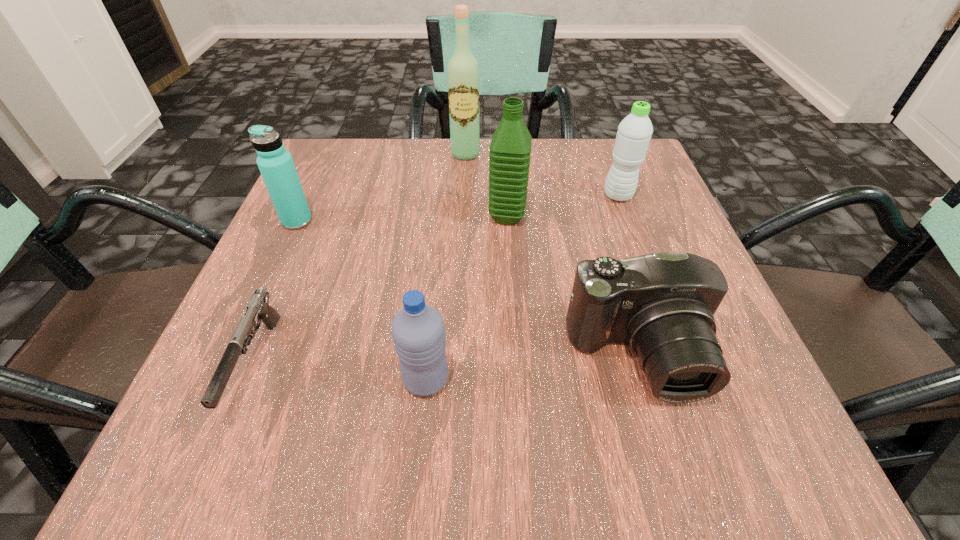
You are a GUI agent. You are given a task and a screenshot of the screen. Output one action in this format:
    pyautogui.click(x=<x>, y=<y>)
    Task: Click on the gun situated at the left edge
    This screenshot has width=960, height=540.
    Given the screenshot: What is the action you would take?
    pyautogui.click(x=258, y=308)

This screenshot has height=540, width=960. Find the location of `water bottle that is at the right edge`. water bottle that is at the right edge is located at coordinates (634, 132).

Find the location of a particular element. The height and width of the screenshot is (540, 960). camera that is at the right edge is located at coordinates (663, 304).

The height and width of the screenshot is (540, 960). Find the location of `object situated at the near left corner`. object situated at the near left corner is located at coordinates (258, 308).

The image size is (960, 540). I want to click on object that is at the far right corner, so click(x=634, y=132).

This screenshot has height=540, width=960. In the image, there is a desktop. Find the location of `blank space at the far edge`. blank space at the far edge is located at coordinates (442, 164).

In the image, there is a desktop. In order to click on vacant space at the near edge in this screenshot , I will do `click(302, 446)`.

Locate an element on the screen. Image resolution: width=960 pixels, height=540 pixels. vacant space at the left edge of the desktop is located at coordinates (282, 249).

In the image, there is a desktop. Identify the location of vacant space at the right edge. The height and width of the screenshot is (540, 960). (768, 407).

Locate an element on the screen. The image size is (960, 540). vacant space at the far left corner of the desktop is located at coordinates (345, 166).